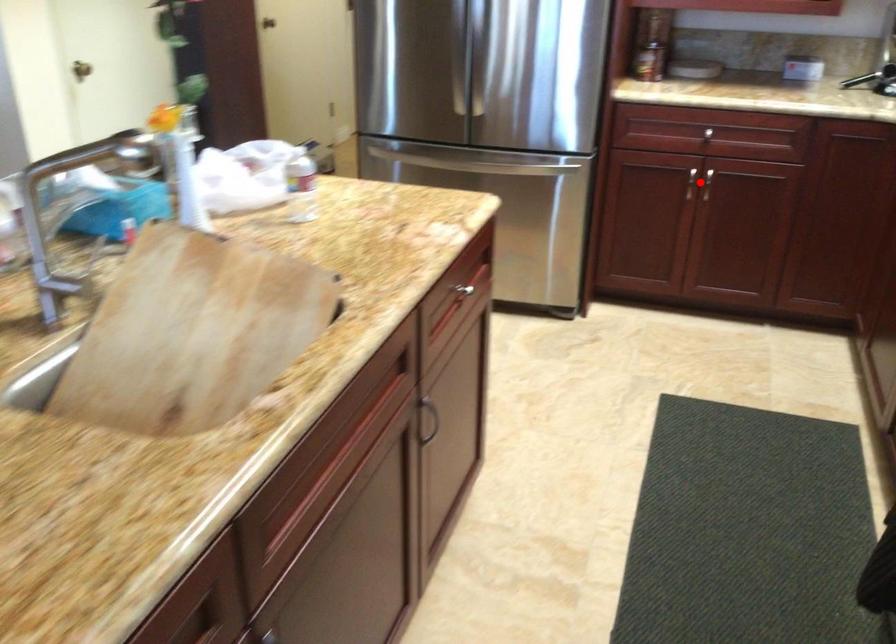
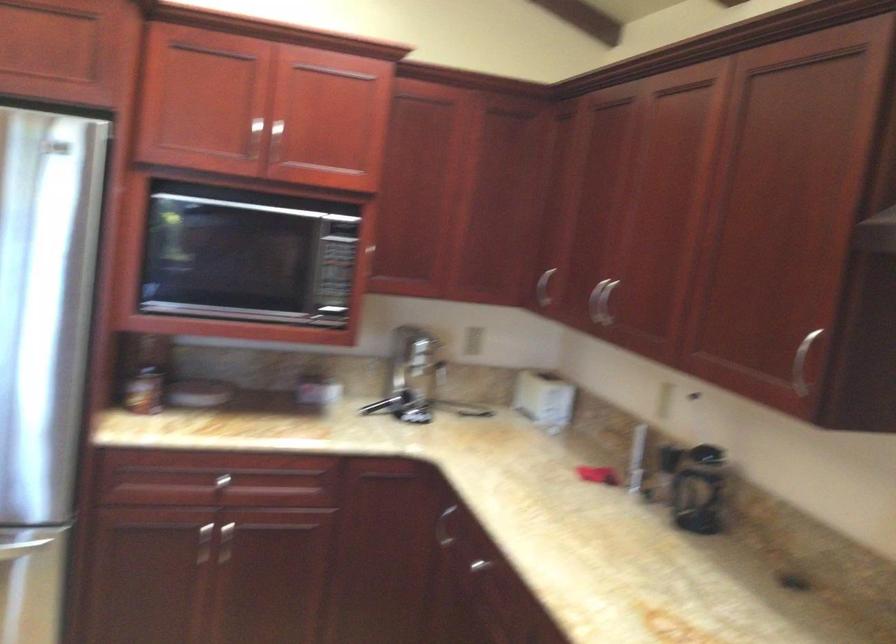
Question: A red point is marked in image1. In image2, is the corresponding 3D point closer to the camera or farther? Reply with the corresponding letter.

Choices:
 (A) The corresponding 3D point is closer.
 (B) The corresponding 3D point is farther.

Answer: (A)